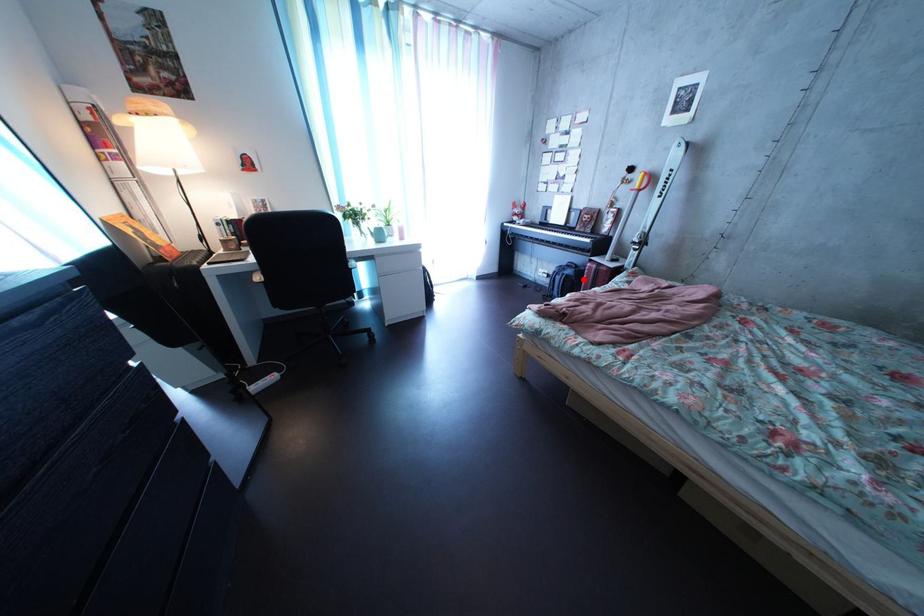
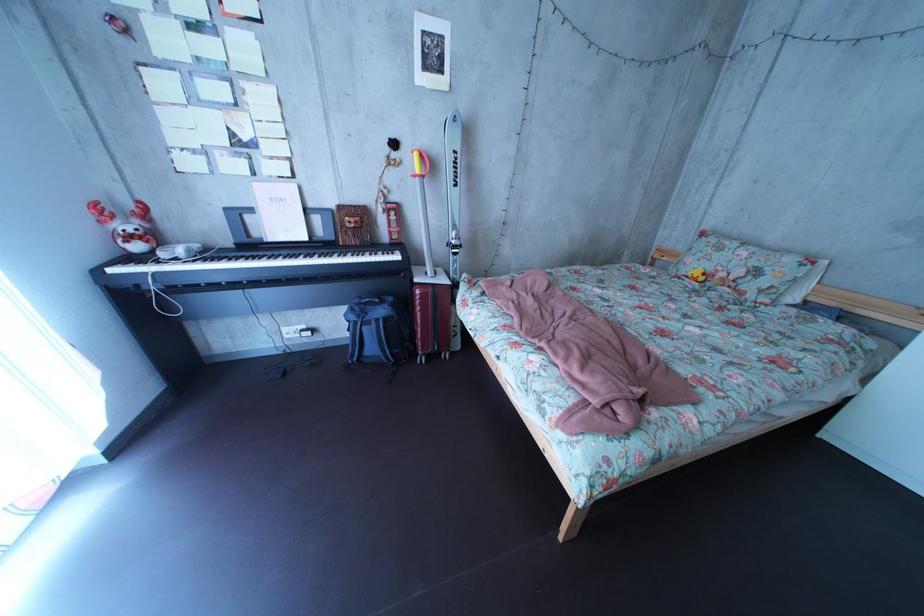
The point at the highlighted location is marked in the first image. Where is the corresponding point in the second image?

(395, 320)